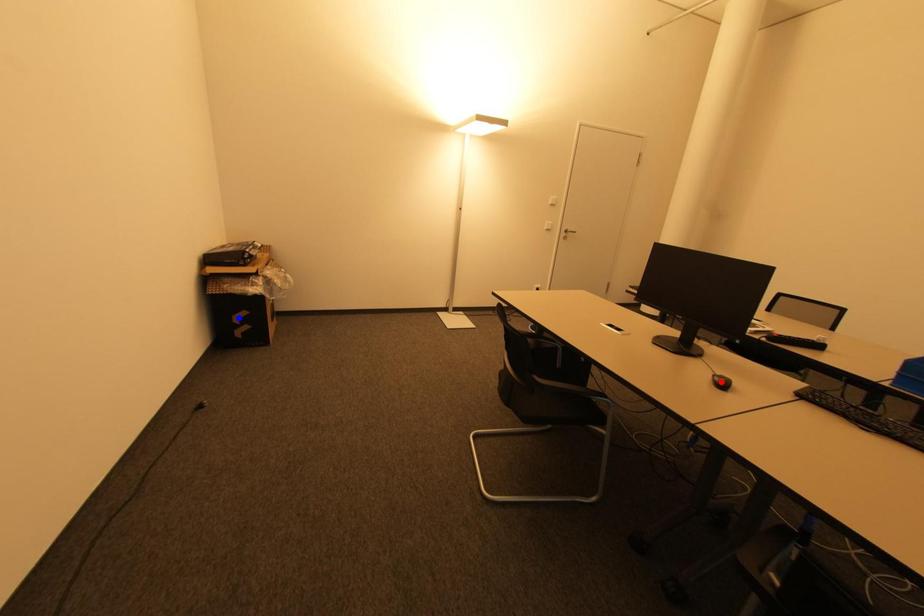
Question: In the image, two points are highlighted. Which point is nearer to the camera? Reply with the corresponding letter.

Choices:
 (A) blue point
 (B) red point

Answer: (B)